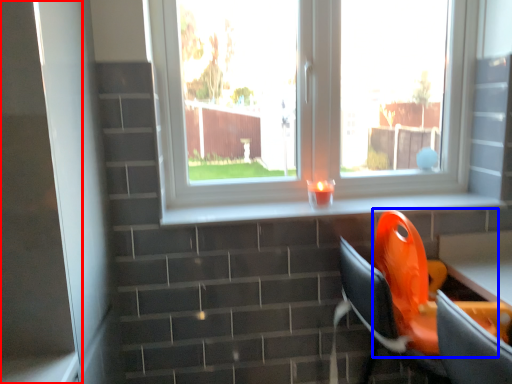
Question: Among these objects, which one is farthest to the camera, screen door (highlighted by a red box) or swivel chair (highlighted by a blue box)?

Choices:
 (A) screen door
 (B) swivel chair

Answer: (B)